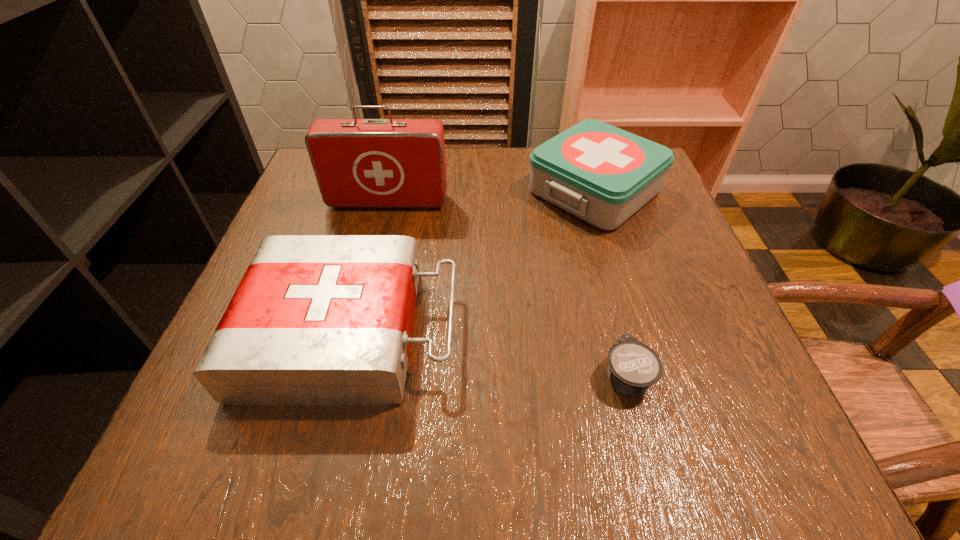
Image resolution: width=960 pixels, height=540 pixels. In order to click on vacant space that satisfies the following two spatial constraints: 1. on the back side of the rightmost first-aid kit; 2. on the right side of the yogurt in this screenshot , I will do `click(578, 192)`.

Locate an element on the screen. vacant area that satisfies the following two spatial constraints: 1. on the side of the tallest object with the first aid cross symbol; 2. on the front side of the nearest first-aid kit is located at coordinates (357, 331).